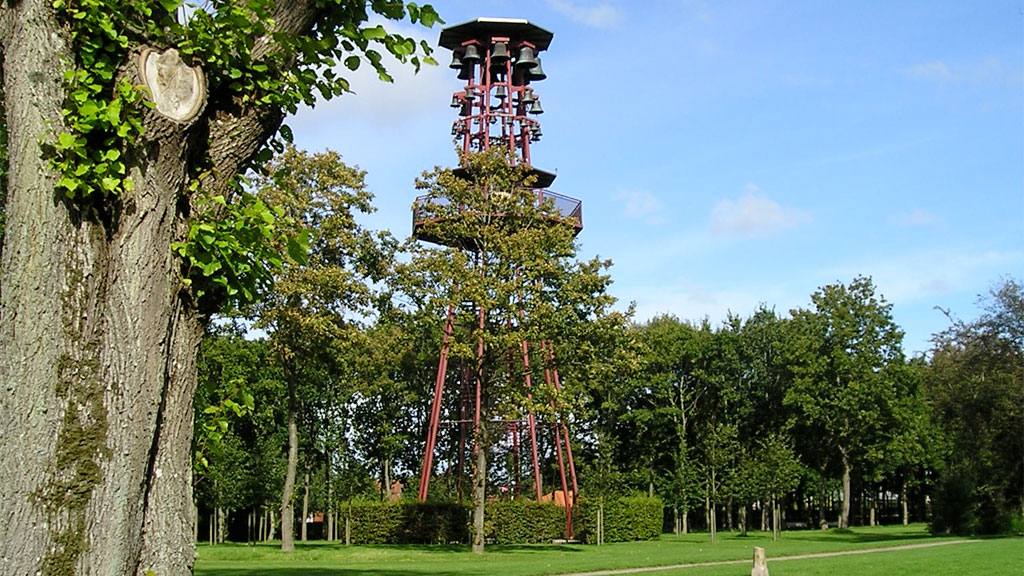
Where is `boxes`? boxes is located at coordinates (536, 74).